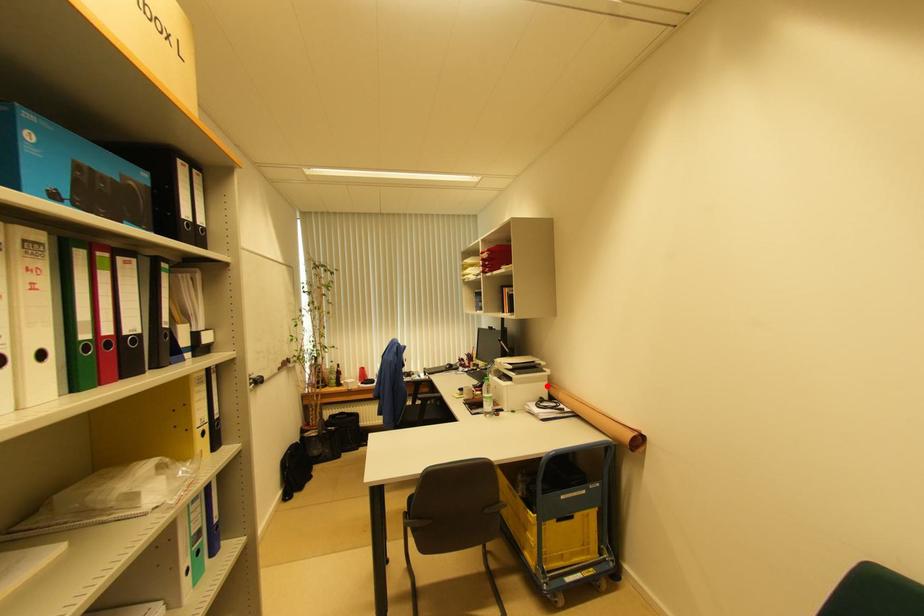
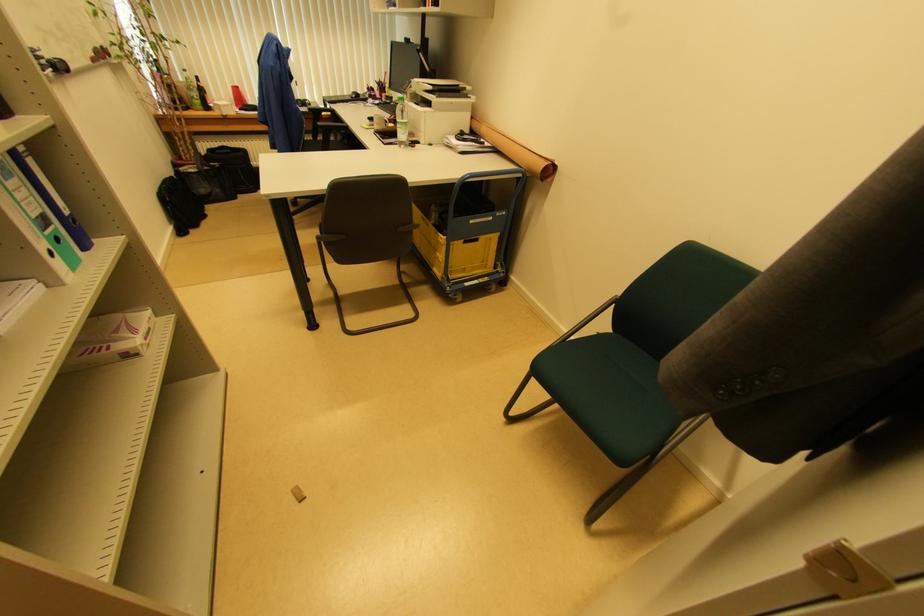
Question: I am providing you with two images of the same scene from different viewpoints. In image1, a red point is highlighted. Considering the same 3D point in image2, which of the following is correct?

Choices:
 (A) It is closer
 (B) It is farther

Answer: (A)